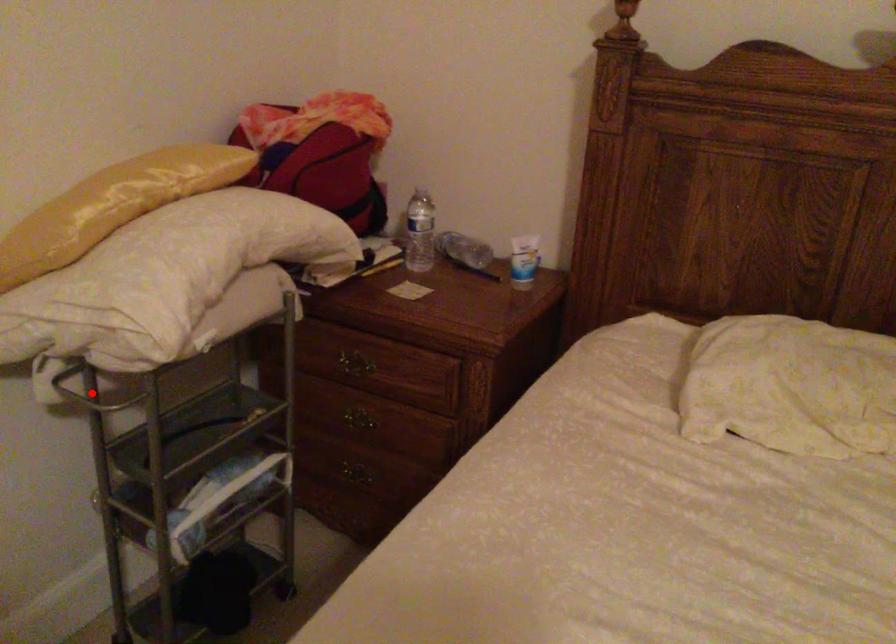
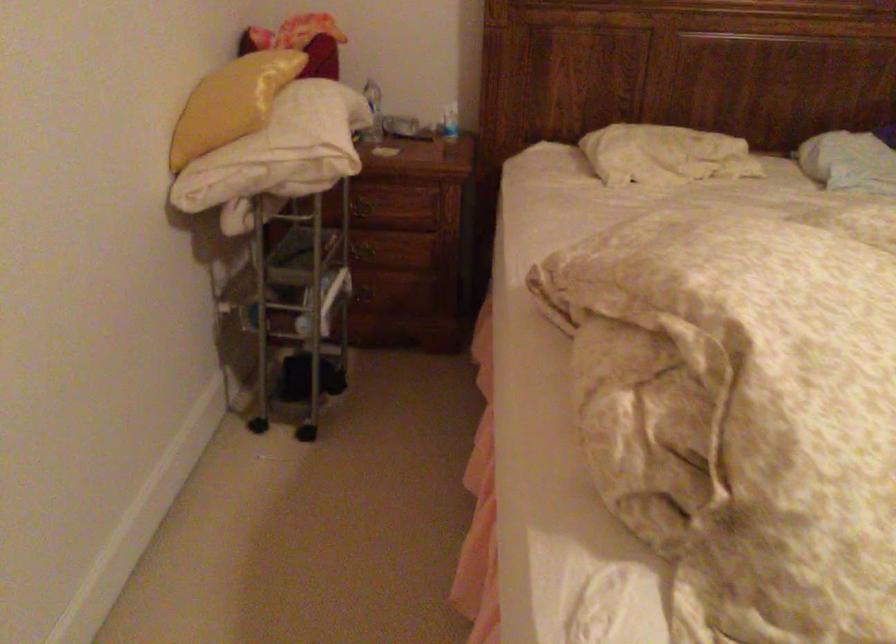
Question: I am providing you with two images of the same scene from different viewpoints. A red point is marked on the first image. At the location where the point appears in image 1, is it still visible in image 2?

Choices:
 (A) Yes
 (B) No

Answer: (B)